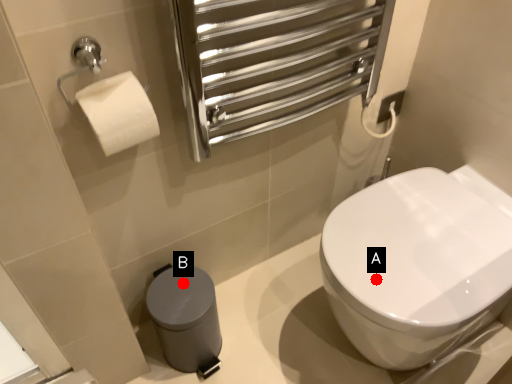
Question: Two points are circled on the image, labeled by A and B beside each circle. Which point appears closest to the camera in this image?

Choices:
 (A) A is closer
 (B) B is closer

Answer: (A)